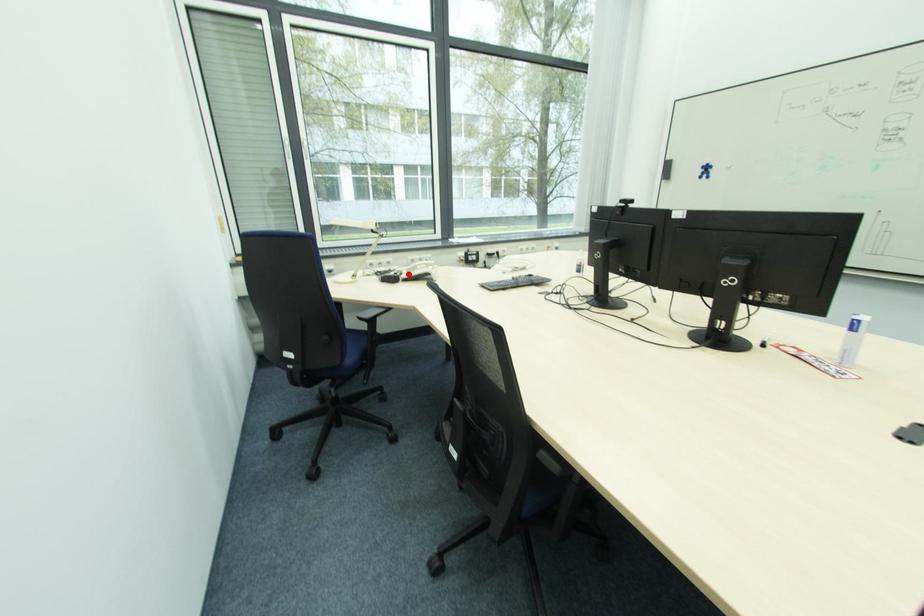
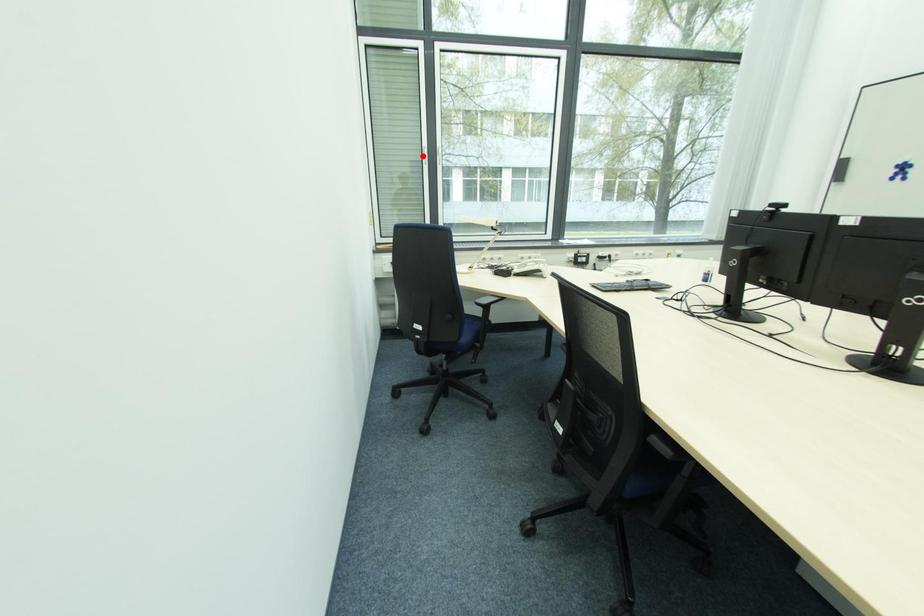
I am providing you with two images of the same scene from different viewpoints. A red point is marked on the first image and another point is marked on the second image. Are the points marked in image1 and image2 representing the same 3D position?

No